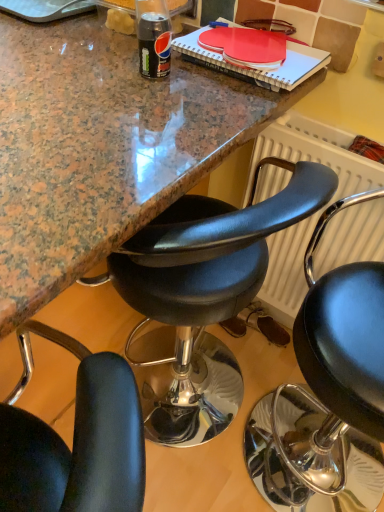
Question: Is black leather chair at center, the 1th chair viewed from the right, not close to white textured radiator at right?

Choices:
 (A) yes
 (B) no

Answer: (B)

Question: Does black leather chair at center, which is the second chair from left to right, have a smaller size compared to white textured radiator at right?

Choices:
 (A) no
 (B) yes

Answer: (A)

Question: Can you confirm if black leather chair at center, the 1th chair viewed from the right, is bigger than white textured radiator at right?

Choices:
 (A) no
 (B) yes

Answer: (B)

Question: Are black leather chair at center, which is the second chair from left to right, and white textured radiator at right making contact?

Choices:
 (A) yes
 (B) no

Answer: (B)

Question: Does black leather chair at center, which is the second chair from left to right, appear on the left side of white textured radiator at right?

Choices:
 (A) yes
 (B) no

Answer: (B)

Question: From the image's perspective, is black leather chair at center, the 1th chair viewed from the right, on white textured radiator at right?

Choices:
 (A) no
 (B) yes

Answer: (A)

Question: From the image's perspective, is black leather chair at center, arranged as the first chair when viewed from the left, on white textured radiator at right?

Choices:
 (A) no
 (B) yes

Answer: (A)

Question: Does black leather chair at center, arranged as the first chair when viewed from the left, have a greater height compared to white textured radiator at right?

Choices:
 (A) no
 (B) yes

Answer: (B)

Question: Is the depth of black leather chair at center, arranged as the first chair when viewed from the left, less than that of white textured radiator at right?

Choices:
 (A) no
 (B) yes

Answer: (B)

Question: Is black leather chair at center, arranged as the first chair when viewed from the left, further to camera compared to white textured radiator at right?

Choices:
 (A) yes
 (B) no

Answer: (B)

Question: Considering the relative sizes of black leather chair at center, positioned as the second chair in right-to-left order, and white textured radiator at right in the image provided, is black leather chair at center, positioned as the second chair in right-to-left order, wider than white textured radiator at right?

Choices:
 (A) yes
 (B) no

Answer: (A)

Question: Considering the relative sizes of black leather chair at center, arranged as the first chair when viewed from the left, and white textured radiator at right in the image provided, is black leather chair at center, arranged as the first chair when viewed from the left, shorter than white textured radiator at right?

Choices:
 (A) no
 (B) yes

Answer: (A)

Question: Are black leather chair at center, which is the second chair from left to right, and black leather chair at center, arranged as the first chair when viewed from the left, far apart?

Choices:
 (A) yes
 (B) no

Answer: (B)